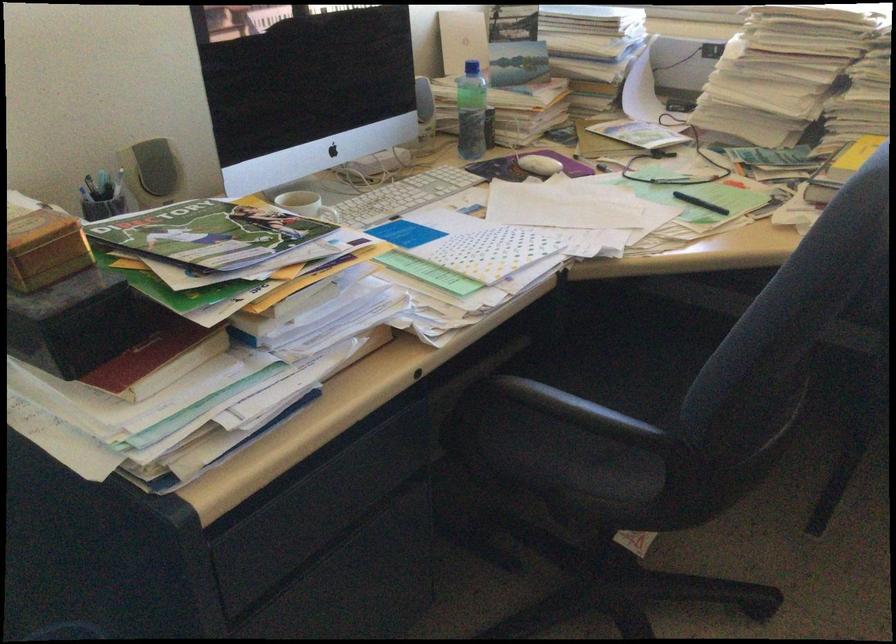
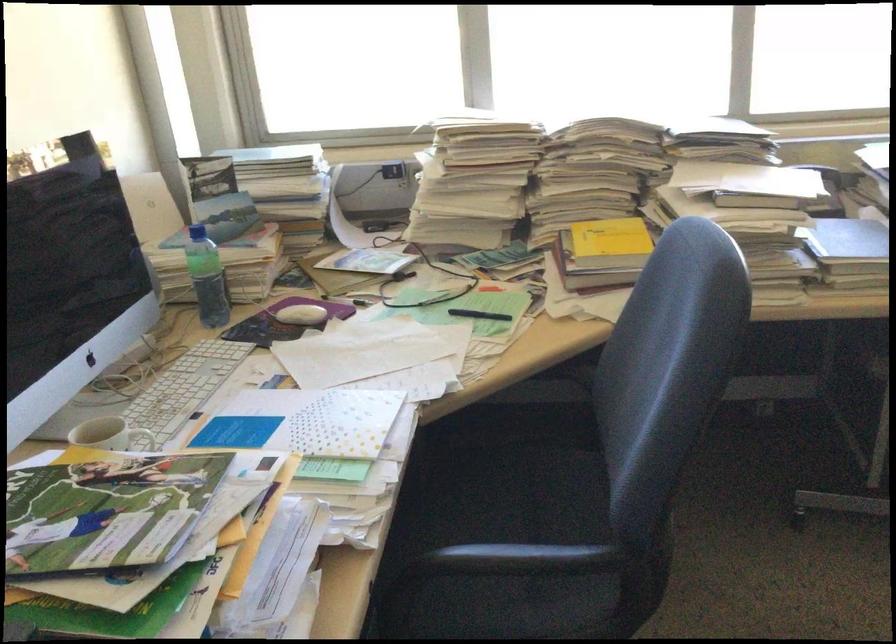
Question: The camera is either moving clockwise (left) or counter-clockwise (right) around the object. The first image is from the beginning of the video and the second image is from the end. Is the camera moving left or right when shooting the video?

Choices:
 (A) Left
 (B) Right

Answer: (A)